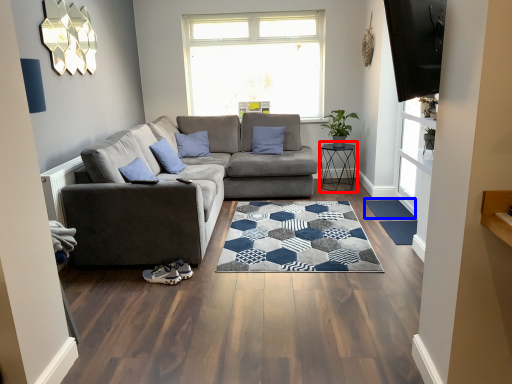
Question: Which point is further to the camera, table (highlighted by a red box) or flat (highlighted by a blue box)?

Choices:
 (A) table
 (B) flat

Answer: (A)